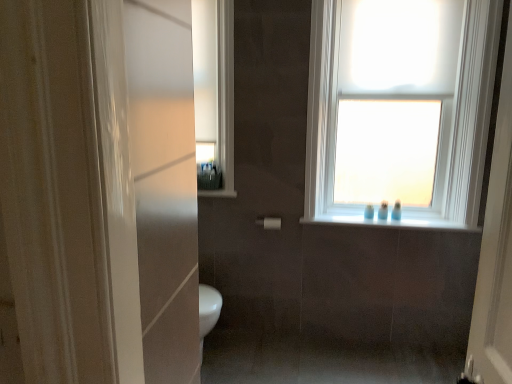
Question: Would you say white glossy window sill at upper center, marked as the 1th window sill in a top-to-bottom arrangement, is to the left or to the right of white matte window at upper center in the picture?

Choices:
 (A) left
 (B) right

Answer: (A)

Question: In terms of height, does white glossy window sill at upper center, marked as the 1th window sill in a top-to-bottom arrangement, look taller or shorter compared to white matte window at upper center?

Choices:
 (A) tall
 (B) short

Answer: (B)

Question: Which object is the closest to the white glossy medicine cabinet at upper left?

Choices:
 (A) matte plastic toiletries at upper center, marked as the first toiletry in a left-to-right arrangement
 (B) blue glossy toothbrush at upper right, the 4th toiletry positioned from the left
 (C) white matte roller shade at upper right
 (D) white glossy window sill at upper center, acting as the second window sill starting from the right
 (E) white matte window at upper center

Answer: (A)

Question: Estimate the real-world distances between objects in this image. Which object is farther from the white matte towel bar at center?

Choices:
 (A) blue glossy toothbrush at upper right, the 4th toiletry positioned from the left
 (B) white glossy window sill at upper center, which appears as the second window sill when viewed from the top
 (C) blue plastic toothbrushes at window, which appears as the second toiletry when viewed from the right
 (D) blue plastic bottle at upper right, the 3th toiletry in the right-to-left sequence
 (E) white glossy window sill at upper center, marked as the 1th window sill in a left-to-right arrangement

Answer: (A)